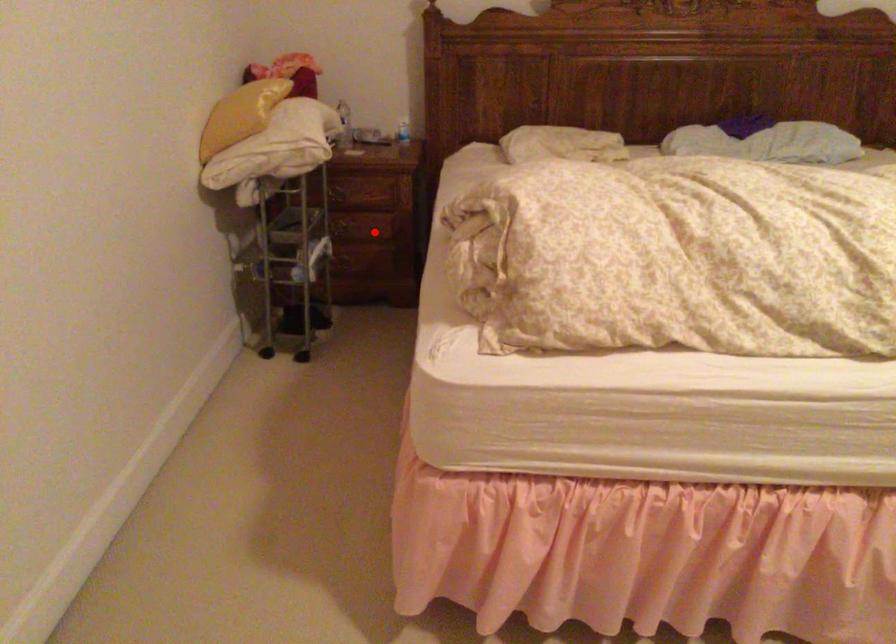
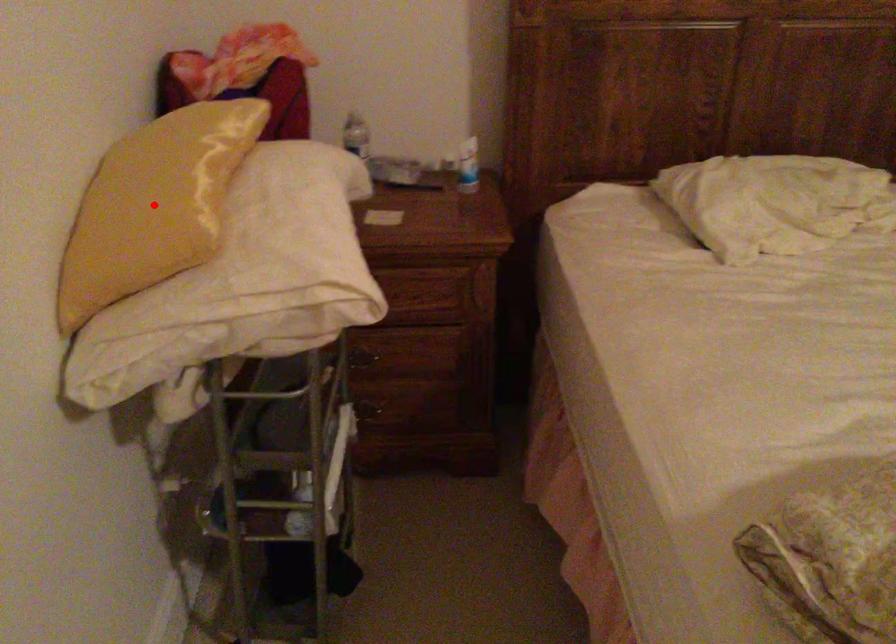
I am providing you with two images of the same scene from different viewpoints. A red point is marked on the first image and another point is marked on the second image. Do the highlighted points in image1 and image2 indicate the same real-world spot?

No